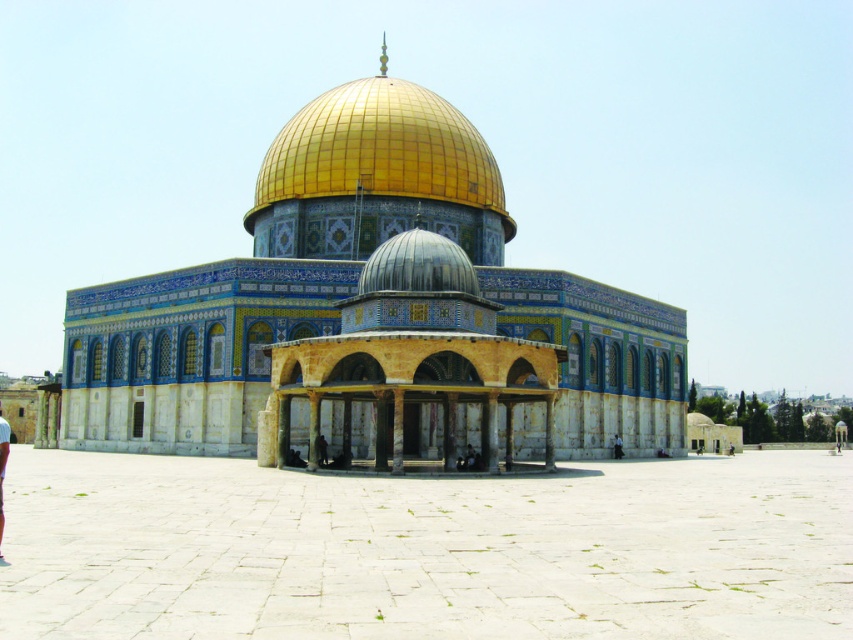
Can you confirm if golden mosaic dome at center is positioned below light blue fabric pants at lower left?

No.

From the picture: Which is more to the right, golden mosaic dome at center or light blue fabric pants at lower left?

golden mosaic dome at center

Who is more forward, (381, 312) or (4, 452)?

Point (4, 452) is in front.

Image resolution: width=853 pixels, height=640 pixels. I want to click on golden mosaic dome at center, so click(373, 316).

Which is above, gold metallic dome at upper center or light blue fabric pants at lower left?

Positioned higher is gold metallic dome at upper center.

Who is more forward, (260,168) or (9,428)?

Point (9,428) is in front.

Locate an element on the screen. gold metallic dome at upper center is located at coordinates (376, 176).

Who is positioned more to the left, golden mosaic dome at center or gold metallic dome at upper center?

Positioned to the left is gold metallic dome at upper center.

Can you confirm if golden mosaic dome at center is shorter than gold metallic dome at upper center?

No, golden mosaic dome at center is not shorter than gold metallic dome at upper center.

Between point (479, 250) and point (334, 195), which one is positioned behind?

The point (479, 250) is more distant.

Identify the location of golden mosaic dome at center. (373, 316).